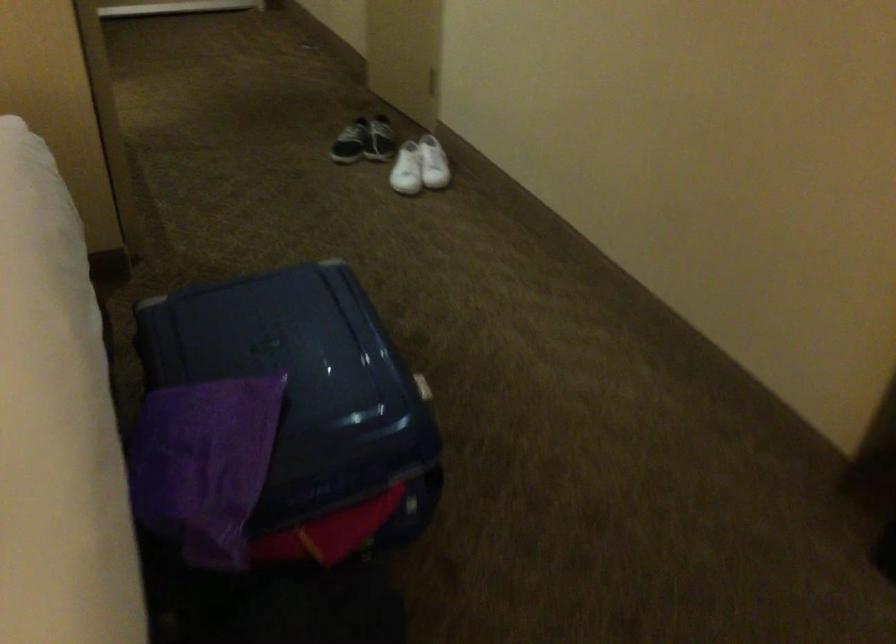
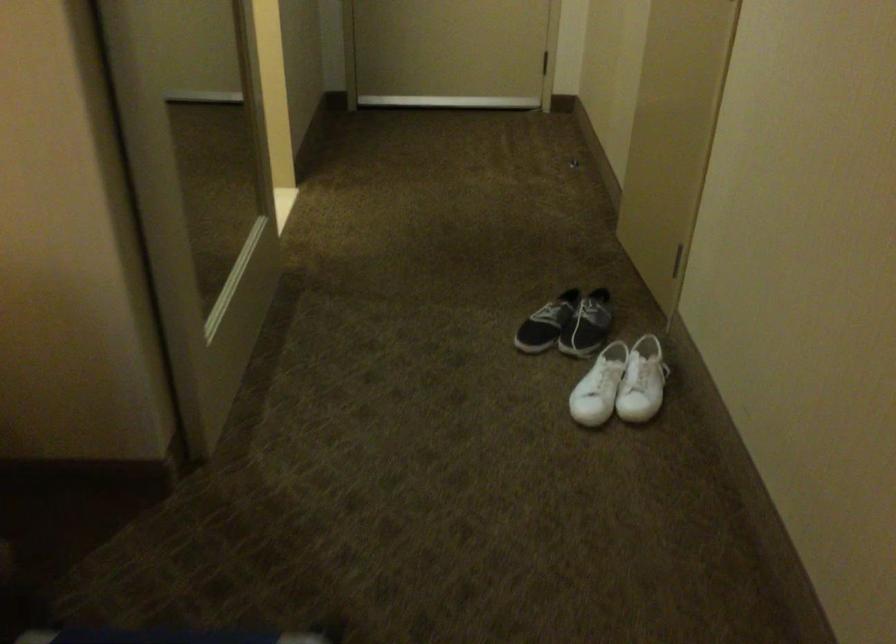
Question: In a continuous first-person perspective shot, in which direction is the camera moving?

Choices:
 (A) Left
 (B) Right
 (C) Forward
 (D) Backward

Answer: (C)